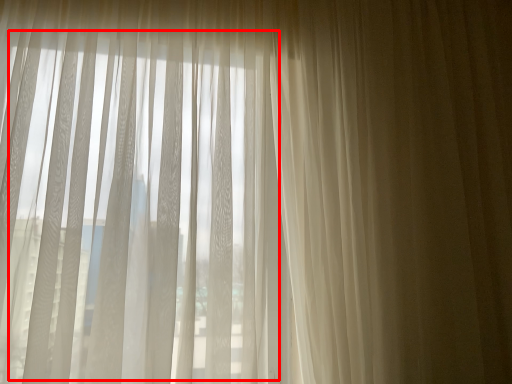
Question: From the image, what is the correct spatial relationship of bay window (annotated by the red box) in relation to curtain?

Choices:
 (A) left
 (B) right

Answer: (A)